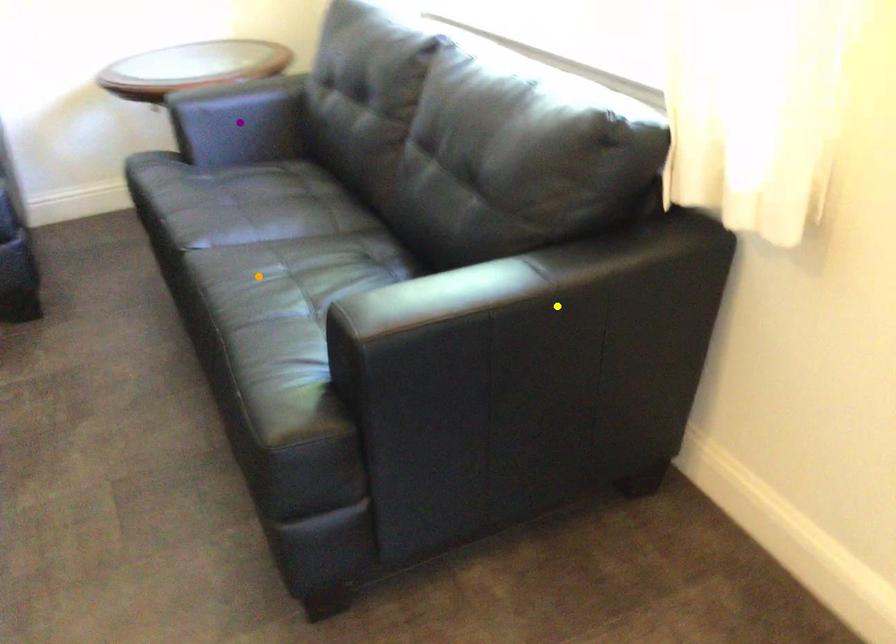
Order these from nearest to farthest:
purple point | orange point | yellow point

purple point
orange point
yellow point